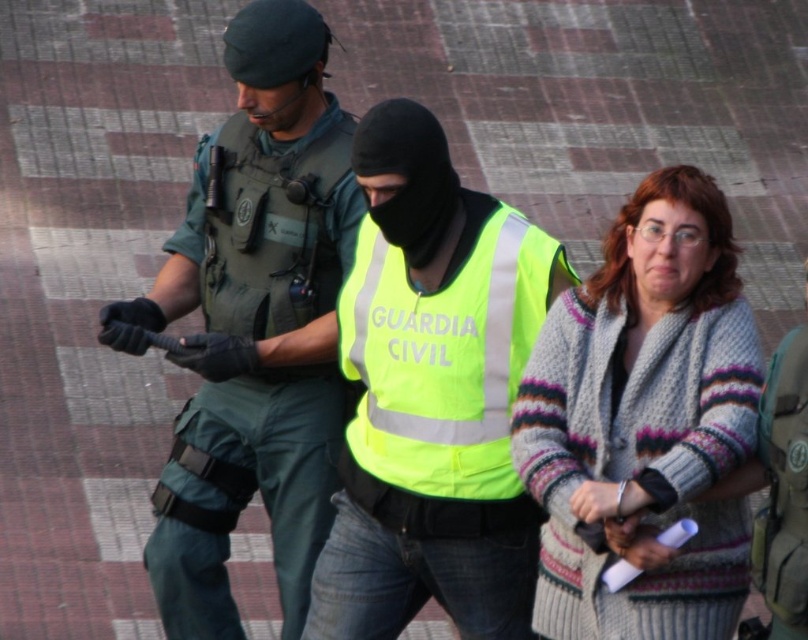
Which is more to the right, knitted sweater at center or neon yellow reflective vest at center?

From the viewer's perspective, knitted sweater at center appears more on the right side.

Looking at this image, who is more forward, (638, 196) or (503, 236)?

Point (638, 196)

Identify the location of knitted sweater at center. The height and width of the screenshot is (640, 808). (644, 422).

Is green tactical vest at center above neon yellow reflective vest at center?

Yes, green tactical vest at center is above neon yellow reflective vest at center.

Is green tactical vest at center positioned before neon yellow reflective vest at center?

Yes, it is.

Locate an element on the screen. The height and width of the screenshot is (640, 808). green tactical vest at center is located at coordinates (253, 324).

Who is taller, green tactical vest at center or knitted sweater at center?

green tactical vest at center

Can you confirm if green tactical vest at center is smaller than knitted sweater at center?

No.

Image resolution: width=808 pixels, height=640 pixels. What do you see at coordinates (253, 324) in the screenshot? I see `green tactical vest at center` at bounding box center [253, 324].

Locate an element on the screen. green tactical vest at center is located at coordinates (253, 324).